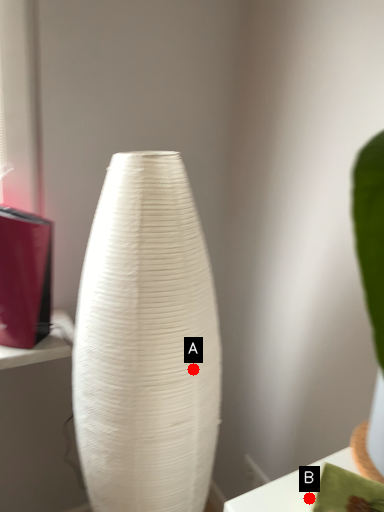
Question: Two points are circled on the image, labeled by A and B beside each circle. Which of the following is the farthest from the observer?

Choices:
 (A) A is further
 (B) B is further

Answer: (A)